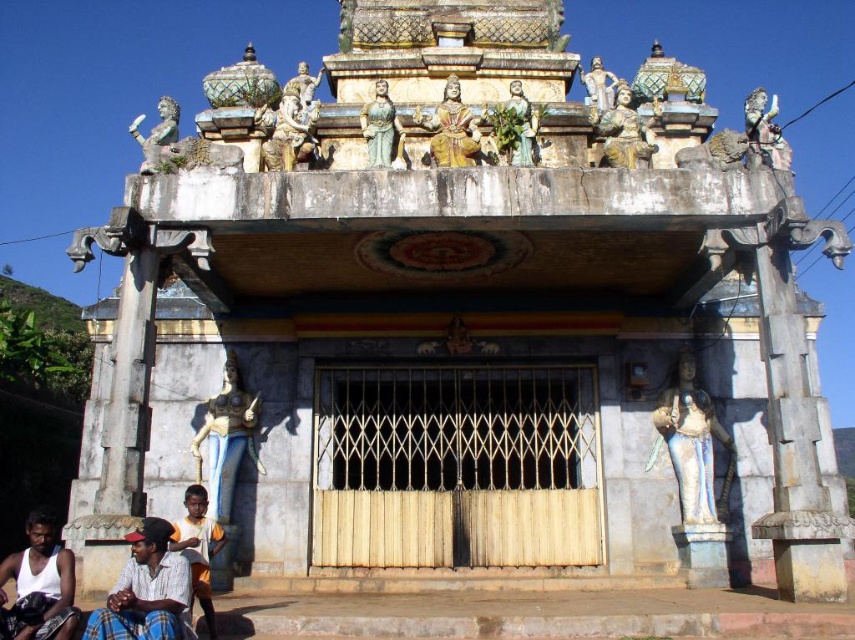
Who is shorter, yellow striped shirt at lower left or gold painted statue at center?

yellow striped shirt at lower left

Between point (201, 561) and point (435, 124), which one is positioned in front?

Positioned in front is point (201, 561).

Is point (198, 588) farther from camera compared to point (469, 150)?

No, (198, 588) is closer to viewer.

This screenshot has height=640, width=855. I want to click on yellow striped shirt at lower left, so click(198, 547).

Can you confirm if yellow striped shirt at lower left is shorter than gold metallic statue at upper right?

Yes, yellow striped shirt at lower left is shorter than gold metallic statue at upper right.

In the scene shown: Who is more forward, [192,513] or [758,145]?

Point [192,513]

Identify the location of yellow striped shirt at lower left. The height and width of the screenshot is (640, 855). (198, 547).

Which is above, wooden gate at center or white cotton shirt at lower left?

Positioned higher is wooden gate at center.

Is point (369, 403) more distant than point (54, 577)?

That is True.

Find the location of a particular element. Image resolution: width=855 pixels, height=640 pixels. wooden gate at center is located at coordinates (455, 467).